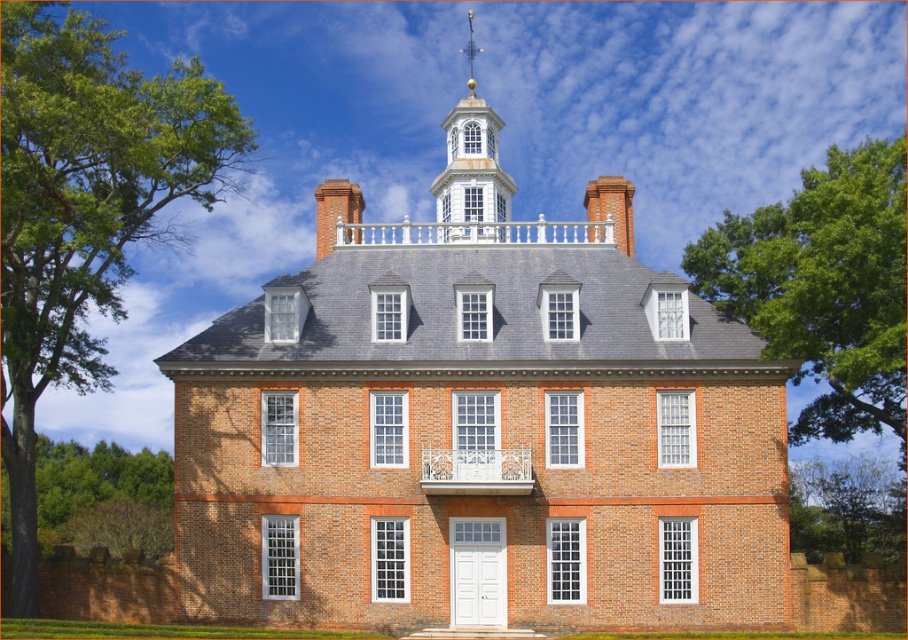
Between green leafy tree at upper right and white painted wood spire at upper center, which one has more height?

With more height is green leafy tree at upper right.

Is green leafy tree at upper right above white painted wood spire at upper center?

No, green leafy tree at upper right is not above white painted wood spire at upper center.

Does point (828, 330) come in front of point (489, 182)?

Yes, point (828, 330) is in front of point (489, 182).

Image resolution: width=908 pixels, height=640 pixels. In order to click on green leafy tree at upper right in this screenshot , I will do `click(825, 288)`.

Does green leafy tree at left appear under green leafy tree at upper right?

Actually, green leafy tree at left is above green leafy tree at upper right.

Who is positioned more to the left, green leafy tree at left or green leafy tree at upper right?

green leafy tree at left

Which is in front, point (76, 77) or point (867, 168)?

Point (867, 168)

In order to click on green leafy tree at left in this screenshot , I will do `click(84, 211)`.

Between point (116, 33) and point (869, 493), which one is positioned in front?

Point (116, 33)

Consider the image. Is green leafy tree at left below green leafy tree at lower right?

No.

Is point (8, 426) less distant than point (794, 525)?

Yes.

Identify the location of green leafy tree at left. (84, 211).